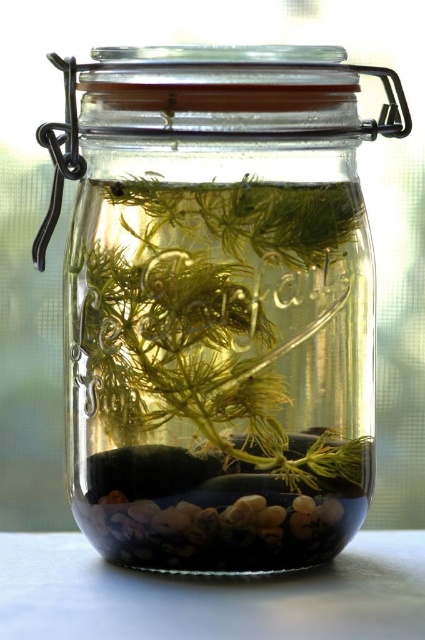
Question: Does clear glass jar at center have a greater width compared to white glossy table at lower center?

Choices:
 (A) no
 (B) yes

Answer: (A)

Question: Among these objects, which one is nearest to the camera?

Choices:
 (A) white glossy table at lower center
 (B) clear glass jar at center

Answer: (A)

Question: Which object is farther from the camera taking this photo?

Choices:
 (A) clear glass jar at center
 (B) translucent green plant at center
 (C) white glossy table at lower center

Answer: (B)

Question: Is clear glass jar at center above white glossy table at lower center?

Choices:
 (A) yes
 (B) no

Answer: (A)

Question: Can you confirm if translucent green plant at center is bigger than white glossy table at lower center?

Choices:
 (A) yes
 (B) no

Answer: (A)

Question: Which of these objects is positioned farthest from the white glossy table at lower center?

Choices:
 (A) translucent green plant at center
 (B) clear glass jar at center

Answer: (B)